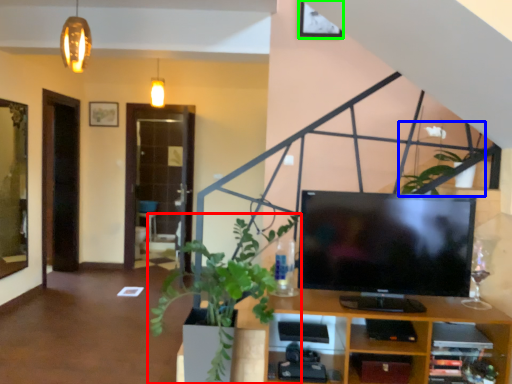
Question: Estimate the real-world distances between objects in this image. Which object is farther from houseplant (highlighted by a red box), plant (highlighted by a blue box) or picture frame (highlighted by a green box)?

Choices:
 (A) plant
 (B) picture frame

Answer: (B)